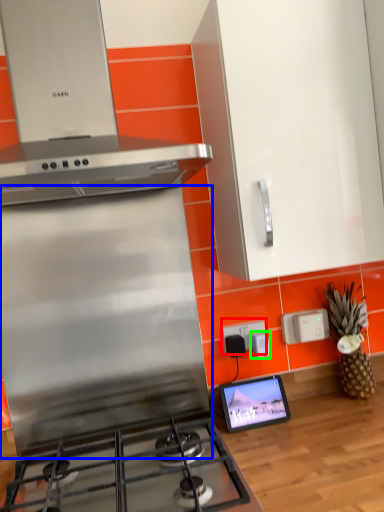
Question: Based on their relative distances, which object is nearer to electric outlet (highlighted by a red box)? Choose from kitchen appliance (highlighted by a blue box) and appliance (highlighted by a green box).

Choices:
 (A) kitchen appliance
 (B) appliance

Answer: (B)